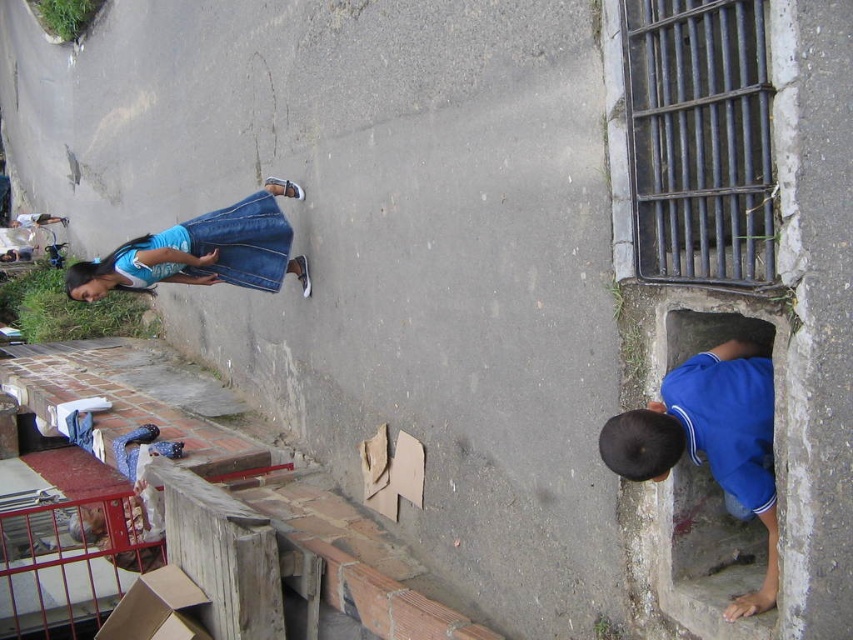
Is blue matte shirt at lower right below denim skirt at upper left?

Indeed, blue matte shirt at lower right is positioned under denim skirt at upper left.

Measure the distance between blue matte shirt at lower right and camera.

A distance of 7.57 feet exists between blue matte shirt at lower right and camera.

Locate an element on the screen. blue matte shirt at lower right is located at coordinates pyautogui.click(x=711, y=440).